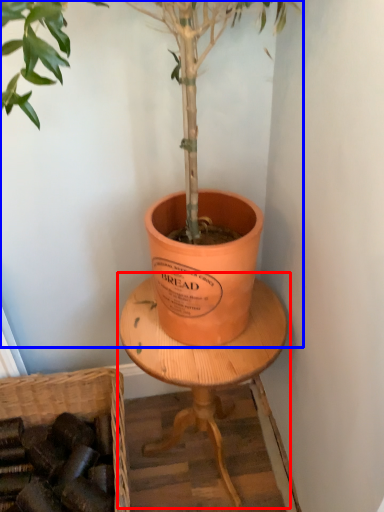
Question: Among these objects, which one is nearest to the camera, round table (highlighted by a red box) or houseplant (highlighted by a blue box)?

Choices:
 (A) round table
 (B) houseplant

Answer: (B)